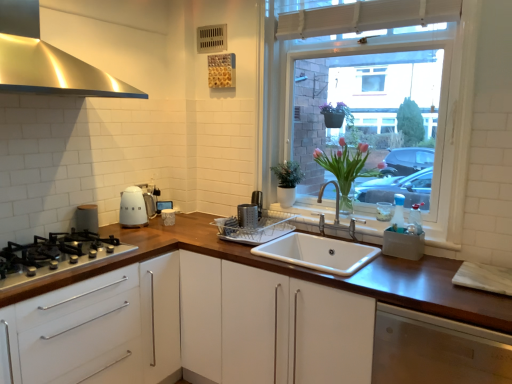
Locate an element on the screen. vacant area located to the right-hand side of matte white kettle at left, the second appliance from the left is located at coordinates (160, 233).